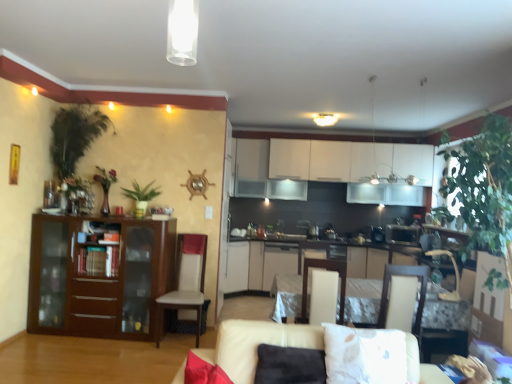
Question: From the image's perspective, is white fabric armchair at center, the 2th armchair when ordered from left to right, over beige fabric couch at lower center?

Choices:
 (A) yes
 (B) no

Answer: (A)

Question: From a real-world perspective, is white fabric armchair at center, the 2th armchair when ordered from left to right, over beige fabric couch at lower center?

Choices:
 (A) no
 (B) yes

Answer: (B)

Question: Can you confirm if white fabric armchair at center, the 2th armchair when ordered from left to right, is thinner than beige fabric couch at lower center?

Choices:
 (A) no
 (B) yes

Answer: (B)

Question: Can you confirm if white fabric armchair at center, the 2th armchair when ordered from left to right, is positioned to the right of beige fabric couch at lower center?

Choices:
 (A) no
 (B) yes

Answer: (B)

Question: Is white fabric armchair at center, the second armchair from the right, positioned far away from beige fabric couch at lower center?

Choices:
 (A) yes
 (B) no

Answer: (A)

Question: From a real-world perspective, relative to beige fabric couch at lower center, is matte wood cabinet at left, the third cabinetry positioned from the back, vertically above or below?

Choices:
 (A) below
 (B) above

Answer: (B)

Question: Considering the positions of matte wood cabinet at left, placed as the third cabinetry when sorted from right to left, and beige fabric couch at lower center in the image, is matte wood cabinet at left, placed as the third cabinetry when sorted from right to left, bigger or smaller than beige fabric couch at lower center?

Choices:
 (A) big
 (B) small

Answer: (A)

Question: Is matte wood cabinet at left, placed as the third cabinetry when sorted from right to left, in front of or behind beige fabric couch at lower center in the image?

Choices:
 (A) front
 (B) behind

Answer: (B)

Question: In terms of height, does matte wood cabinet at left, placed as the third cabinetry when sorted from right to left, look taller or shorter compared to beige fabric couch at lower center?

Choices:
 (A) tall
 (B) short

Answer: (A)

Question: From a real-world perspective, is satin gold microwave at center above or below green matte plant at center-left, acting as the second plant starting from the left?

Choices:
 (A) above
 (B) below

Answer: (B)

Question: Choose the correct answer: Is satin gold microwave at center inside green matte plant at center-left, the 1th plant from the right, or outside it?

Choices:
 (A) outside
 (B) inside

Answer: (A)

Question: Considering the relative positions of satin gold microwave at center and green matte plant at center-left, acting as the second plant starting from the left, in the image provided, is satin gold microwave at center to the left or to the right of green matte plant at center-left, acting as the second plant starting from the left,?

Choices:
 (A) left
 (B) right

Answer: (B)

Question: Is satin gold microwave at center in front of or behind green matte plant at center-left, the 1th plant from the right, in the image?

Choices:
 (A) front
 (B) behind

Answer: (B)

Question: In terms of width, does beige fabric couch at lower center look wider or thinner when compared to white fabric armchair at center, the second armchair from the right?

Choices:
 (A) thin
 (B) wide

Answer: (B)

Question: Is beige fabric couch at lower center taller or shorter than white fabric armchair at center, the 2th armchair when ordered from left to right?

Choices:
 (A) short
 (B) tall

Answer: (A)